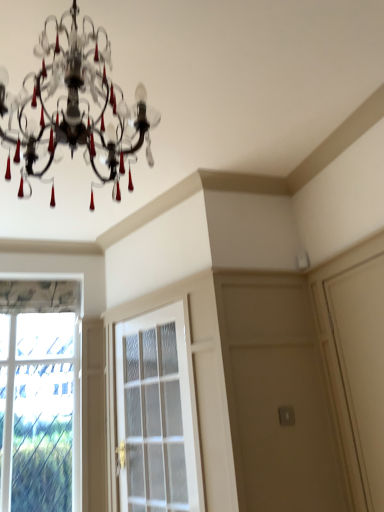
Question: Does clear glass window at left appear on the left side of white glass screen door at center?

Choices:
 (A) yes
 (B) no

Answer: (A)

Question: Is clear glass window at left oriented towards white glass screen door at center?

Choices:
 (A) no
 (B) yes

Answer: (A)

Question: Would you say clear glass window at left is outside white glass screen door at center?

Choices:
 (A) no
 (B) yes

Answer: (B)

Question: From the image's perspective, is clear glass window at left located above white glass screen door at center?

Choices:
 (A) no
 (B) yes

Answer: (A)

Question: Does clear glass window at left have a larger size compared to white glass screen door at center?

Choices:
 (A) yes
 (B) no

Answer: (B)

Question: Is clear glass window at left inside or outside of matte black chandelier at upper center?

Choices:
 (A) outside
 (B) inside

Answer: (A)

Question: Considering the positions of clear glass window at left and matte black chandelier at upper center in the image, is clear glass window at left wider or thinner than matte black chandelier at upper center?

Choices:
 (A) wide
 (B) thin

Answer: (B)

Question: Is point (72, 292) positioned closer to the camera than point (72, 73)?

Choices:
 (A) closer
 (B) farther

Answer: (B)

Question: Is clear glass window at left bigger or smaller than matte black chandelier at upper center?

Choices:
 (A) big
 (B) small

Answer: (B)

Question: From the image's perspective, is white glass screen door at center positioned above or below matte black chandelier at upper center?

Choices:
 (A) above
 (B) below

Answer: (B)

Question: Is white glass screen door at center wider or thinner than matte black chandelier at upper center?

Choices:
 (A) thin
 (B) wide

Answer: (A)

Question: Based on their positions, is white glass screen door at center located to the left or right of matte black chandelier at upper center?

Choices:
 (A) left
 (B) right

Answer: (B)

Question: Considering the positions of point (135, 439) and point (54, 79), is point (135, 439) closer or farther from the camera than point (54, 79)?

Choices:
 (A) farther
 (B) closer

Answer: (A)

Question: From the image's perspective, is matte black chandelier at upper center located above or below clear glass window at left?

Choices:
 (A) above
 (B) below

Answer: (A)

Question: Is point (69, 94) closer or farther from the camera than point (49, 339)?

Choices:
 (A) closer
 (B) farther

Answer: (A)